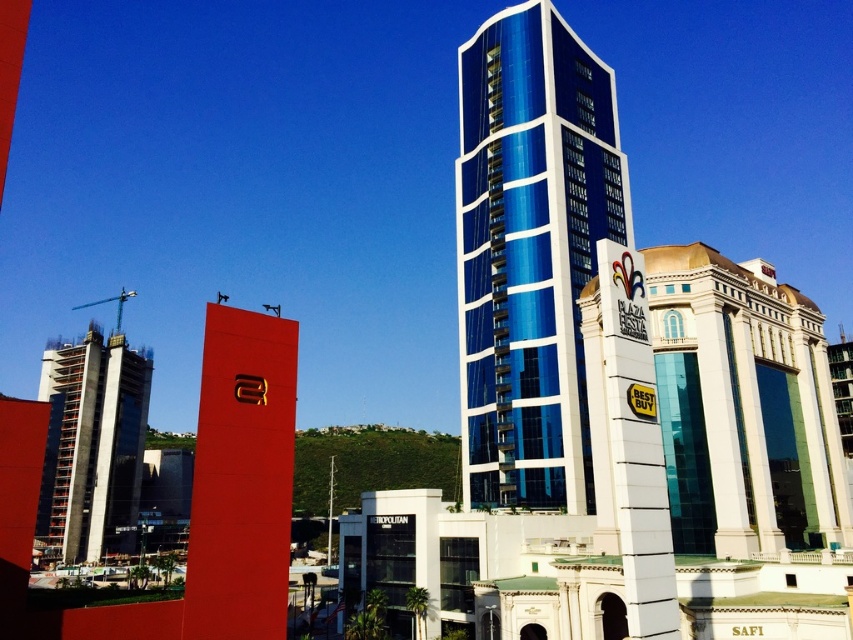
Question: Is blue glass building at center above dark gray concrete construction at left?

Choices:
 (A) yes
 (B) no

Answer: (A)

Question: Does blue glass building at center appear over dark gray concrete construction at left?

Choices:
 (A) yes
 (B) no

Answer: (A)

Question: Is blue glass building at center closer to camera compared to dark gray concrete construction at left?

Choices:
 (A) yes
 (B) no

Answer: (A)